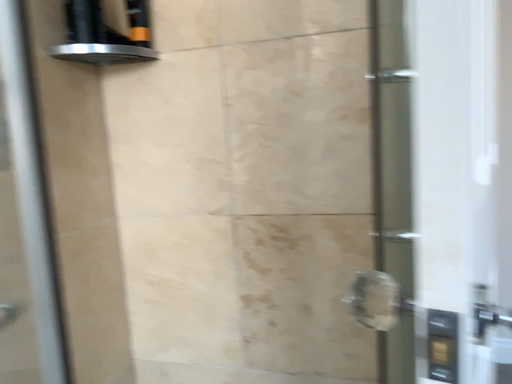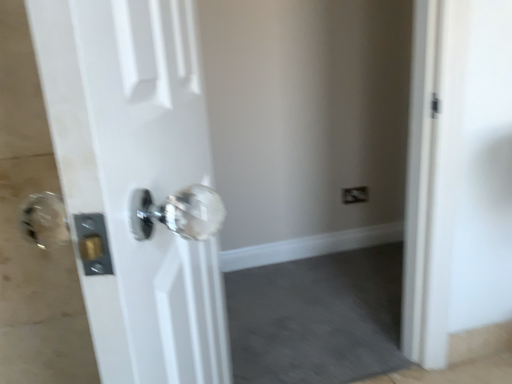
Question: Which way did the camera rotate in the video?

Choices:
 (A) rotated right
 (B) rotated left

Answer: (A)